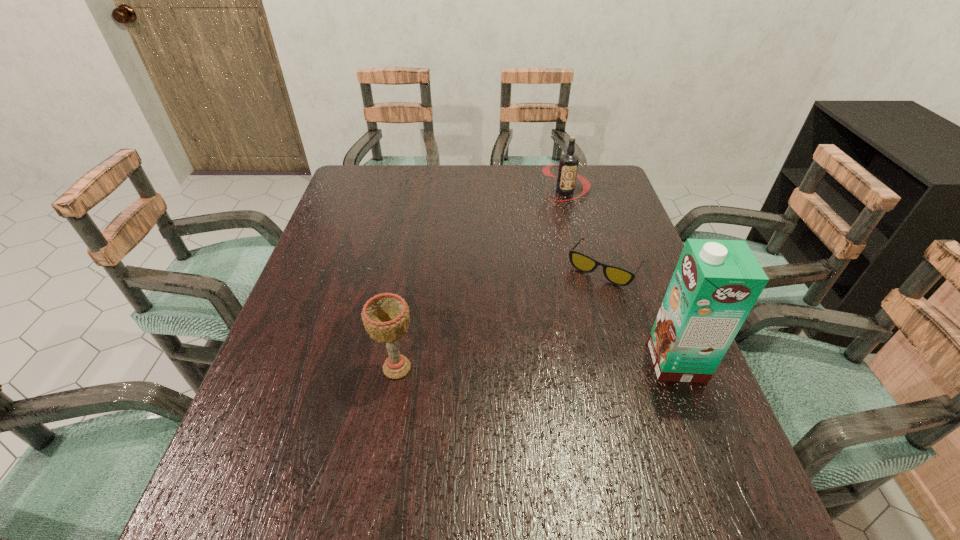
The image size is (960, 540). What are the coordinates of `vacant space situated 0.050m on the label of the root beer` in the screenshot? It's located at (x=563, y=213).

Locate an element on the screen. This screenshot has width=960, height=540. vacant space located 0.400m on the label of the root beer is located at coordinates (553, 292).

Locate an element on the screen. This screenshot has width=960, height=540. free region located 0.100m on the label of the root beer is located at coordinates (561, 222).

Image resolution: width=960 pixels, height=540 pixels. I want to click on object that is at the far edge, so click(568, 165).

Locate an element on the screen. carton that is positioned at the right edge is located at coordinates pyautogui.click(x=716, y=283).

Identify the location of sunglasses situated at the right edge. (619, 276).

Find the location of `root beer that is positioned at the right edge`. root beer that is positioned at the right edge is located at coordinates (568, 165).

Find the location of a particular element. object located at the far right corner is located at coordinates (568, 165).

Image resolution: width=960 pixels, height=540 pixels. What are the coordinates of `free space at the far edge of the desktop` in the screenshot? It's located at (402, 201).

You are a GUI agent. You are given a task and a screenshot of the screen. Output one action in this format:
    pyautogui.click(x=<x>, y=<y>)
    Task: Click on the vacant space at the left edge of the desktop
    This screenshot has width=960, height=540.
    Given the screenshot: What is the action you would take?
    pyautogui.click(x=350, y=314)